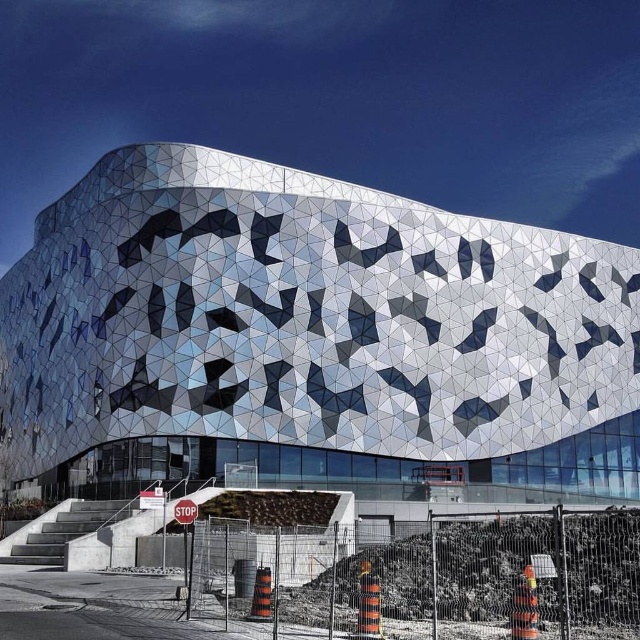
You are a drone operator tasked with capturing aerial footage of the metallic geometric facade at center. The drone must maintain a minimum altitude of 10 meters to avoid interfering with nearby air traffic. Given the coordinates provided, can you confirm if the drone will be able to capture the facade without violating the altitude restriction?

The metallic geometric facade at center is positioned at coordinates point [310,333]. Since the drone must maintain a minimum altitude of 10 meters, and the coordinates do not indicate elevation, the altitude restriction is unrelated to the facade location. The drone can capture the facade as long as it adheres to the altitude requirement.

You are standing at the entrance of the building and see two points marked on the ground. The first point is at coordinates point (460,429) and the second is at point (188,508). If you want to walk from the entrance towards the first point, will you pass by the second point on your way?

Point (460,429) is behind point (188,508), so if you walk from the entrance towards the first point, you will pass by the second point on your way.